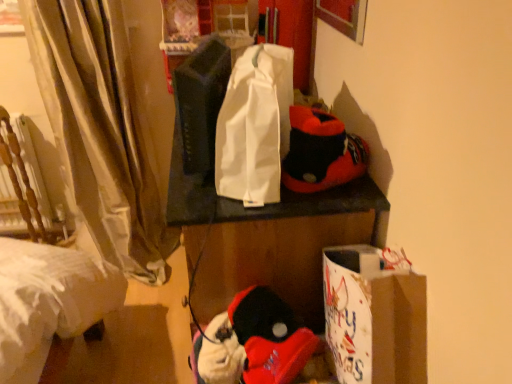
Question: From a real-world perspective, does fluffy white plush at lower center, arranged as the first toy when viewed from the left, stand above matte black speaker at center, arranged as the 2th twin when viewed from the right?

Choices:
 (A) yes
 (B) no

Answer: (B)

Question: Is fluffy white plush at lower center, arranged as the first toy when viewed from the left, in contact with matte black speaker at center, marked as the first twin in a left-to-right arrangement?

Choices:
 (A) yes
 (B) no

Answer: (B)

Question: Is fluffy white plush at lower center, placed as the 2th toy when sorted from right to left, completely or partially outside of matte black speaker at center, arranged as the 2th twin when viewed from the right?

Choices:
 (A) no
 (B) yes

Answer: (B)

Question: From the image's perspective, does fluffy white plush at lower center, arranged as the first toy when viewed from the left, appear lower than matte black speaker at center, marked as the first twin in a left-to-right arrangement?

Choices:
 (A) no
 (B) yes

Answer: (B)

Question: Does fluffy white plush at lower center, placed as the 2th toy when sorted from right to left, appear on the left side of matte black speaker at center, arranged as the 2th twin when viewed from the right?

Choices:
 (A) yes
 (B) no

Answer: (B)

Question: In terms of width, does wooden armchair at left look wider or thinner when compared to soft plush slippers at upper right, acting as the second twin starting from the left?

Choices:
 (A) wide
 (B) thin

Answer: (A)

Question: From the image's perspective, is wooden armchair at left positioned above or below soft plush slippers at upper right, the first twin when ordered from right to left?

Choices:
 (A) above
 (B) below

Answer: (B)

Question: From their relative heights in the image, would you say wooden armchair at left is taller or shorter than soft plush slippers at upper right, acting as the second twin starting from the left?

Choices:
 (A) tall
 (B) short

Answer: (A)

Question: Is point (9, 173) positioned closer to the camera than point (314, 132)?

Choices:
 (A) farther
 (B) closer

Answer: (A)

Question: Is matte black speaker at center, arranged as the 2th twin when viewed from the right, situated inside white paper bag at lower right or outside?

Choices:
 (A) outside
 (B) inside

Answer: (A)

Question: Is point (206, 155) closer or farther from the camera than point (418, 350)?

Choices:
 (A) closer
 (B) farther

Answer: (B)

Question: Considering the positions of matte black speaker at center, arranged as the 2th twin when viewed from the right, and white paper bag at lower right in the image, is matte black speaker at center, arranged as the 2th twin when viewed from the right, taller or shorter than white paper bag at lower right?

Choices:
 (A) tall
 (B) short

Answer: (A)

Question: In the image, is matte black speaker at center, marked as the first twin in a left-to-right arrangement, positioned in front of or behind white paper bag at lower right?

Choices:
 (A) behind
 (B) front

Answer: (A)

Question: In terms of width, does white fabric tote bag at center look wider or thinner when compared to soft plush slippers at upper right, the first twin when ordered from right to left?

Choices:
 (A) thin
 (B) wide

Answer: (A)

Question: Considering their positions, is white fabric tote bag at center located in front of or behind soft plush slippers at upper right, the first twin when ordered from right to left?

Choices:
 (A) front
 (B) behind

Answer: (A)